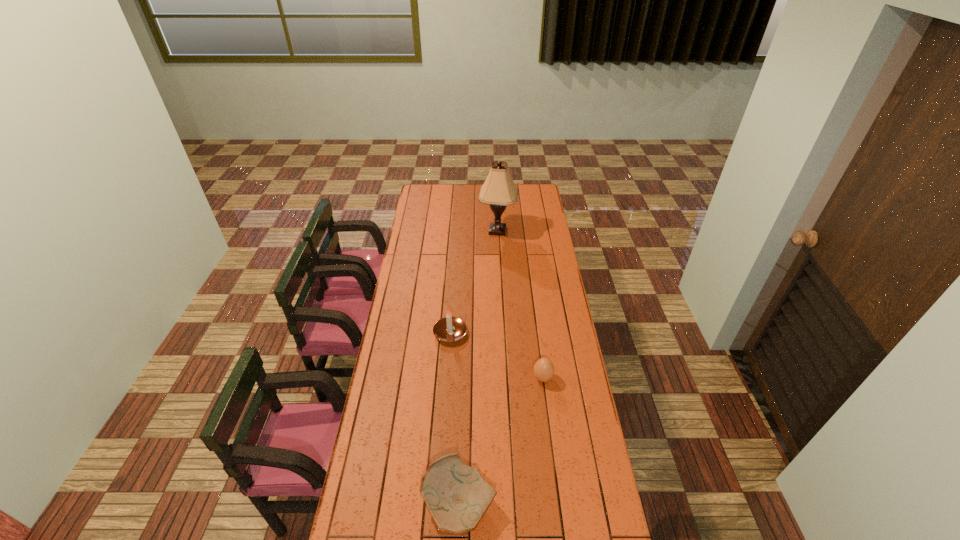
Locate an element on the screen. lamp is located at coordinates (498, 190).

Locate an element on the screen. the farthest object is located at coordinates (498, 190).

The image size is (960, 540). Identify the location of the third nearest object. (449, 329).

Find the location of a particular element. candle is located at coordinates (449, 329).

Where is `the second nearest object`? the second nearest object is located at coordinates (543, 370).

Identify the location of free point located 0.400m on the left of the tallest object. Image resolution: width=960 pixels, height=540 pixels. (410, 231).

This screenshot has width=960, height=540. Identify the location of free space located 0.190m on the left of the candle. (392, 333).

The width and height of the screenshot is (960, 540). I want to click on free region located 0.200m on the front of the boiled egg, so click(x=550, y=432).

I want to click on object that is at the right edge, so click(543, 370).

In the image, there is a desktop. Where is `vacant space at the far edge`? The width and height of the screenshot is (960, 540). vacant space at the far edge is located at coordinates (478, 188).